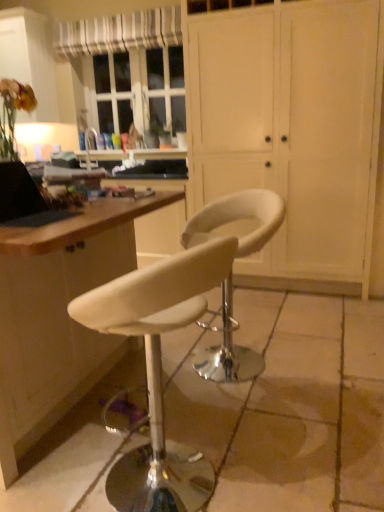
Question: From the image's perspective, is white leather stool at center, placed as the 1th chair when sorted from front to back, located above or below matte white cabinet at upper left?

Choices:
 (A) below
 (B) above

Answer: (A)

Question: From a real-world perspective, is white leather stool at center, which appears as the 2th chair when viewed from the back, physically located above or below matte white cabinet at upper left?

Choices:
 (A) above
 (B) below

Answer: (B)

Question: Which of these objects is positioned farthest from the matte white cabinet at upper left?

Choices:
 (A) white matte cabinet at center
 (B) white leather stool at center, placed as the 1th chair when sorted from front to back
 (C) white leather stool at center
 (D) white leather stool at center, placed as the second chair when sorted from front to back
 (E) white striped fabric at upper left

Answer: (B)

Question: Estimate the real-world distances between objects in this image. Which object is closer to the white leather stool at center, which appears as the first chair when viewed from the back?

Choices:
 (A) wooden desk at lower left
 (B) white leather stool at center
 (C) white matte cabinet at center
 (D) white leather stool at center, placed as the 1th chair when sorted from front to back
 (E) black matte laptop at left

Answer: (A)